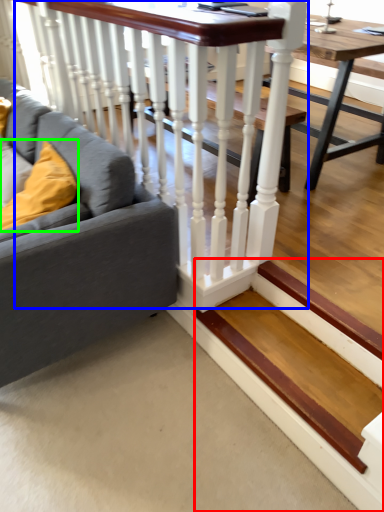
Question: Which object is positioned farthest from stairs (highlighted by a red box)? Select from rail (highlighted by a blue box) and pillow (highlighted by a green box).

Choices:
 (A) rail
 (B) pillow

Answer: (B)